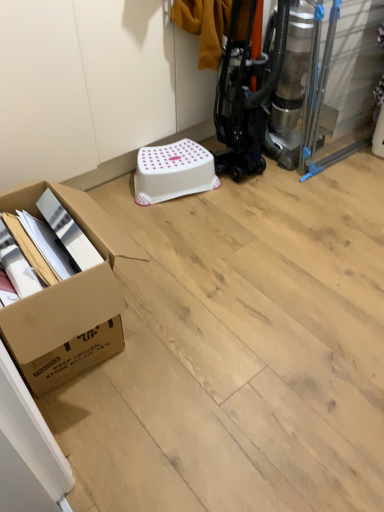
Locate an element on the screen. This screenshot has height=512, width=384. vacant space behind brown cardboard box at lower left is located at coordinates (153, 228).